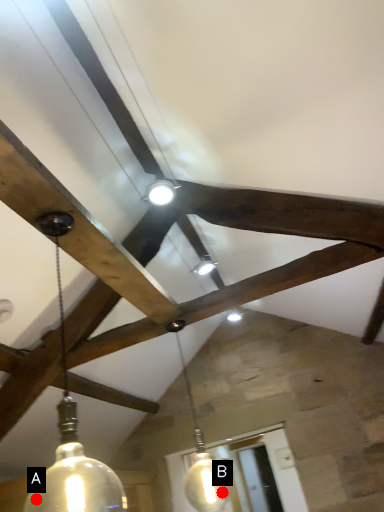
Question: Two points are circled on the image, labeled by A and B beside each circle. Which of the following is the farthest from the observer?

Choices:
 (A) A is further
 (B) B is further

Answer: (B)